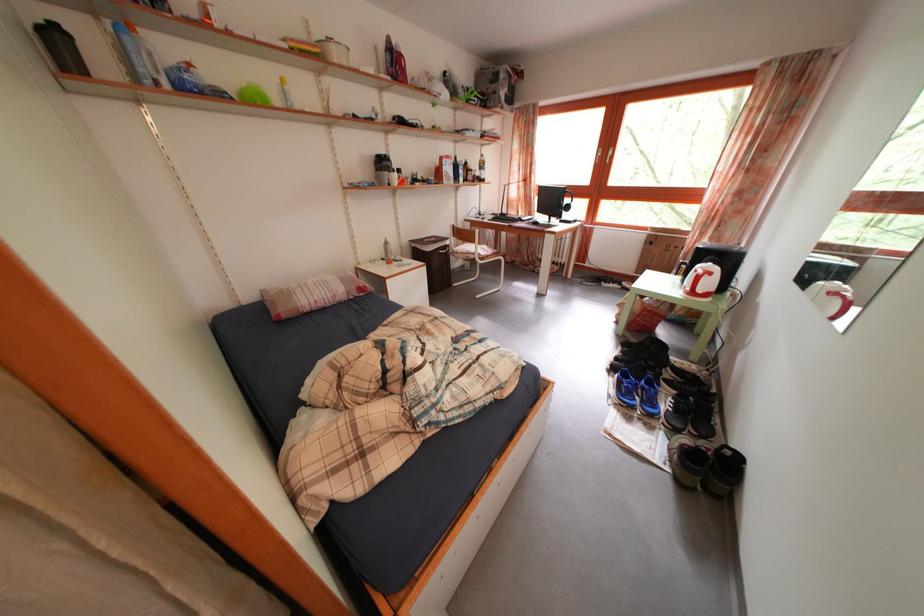
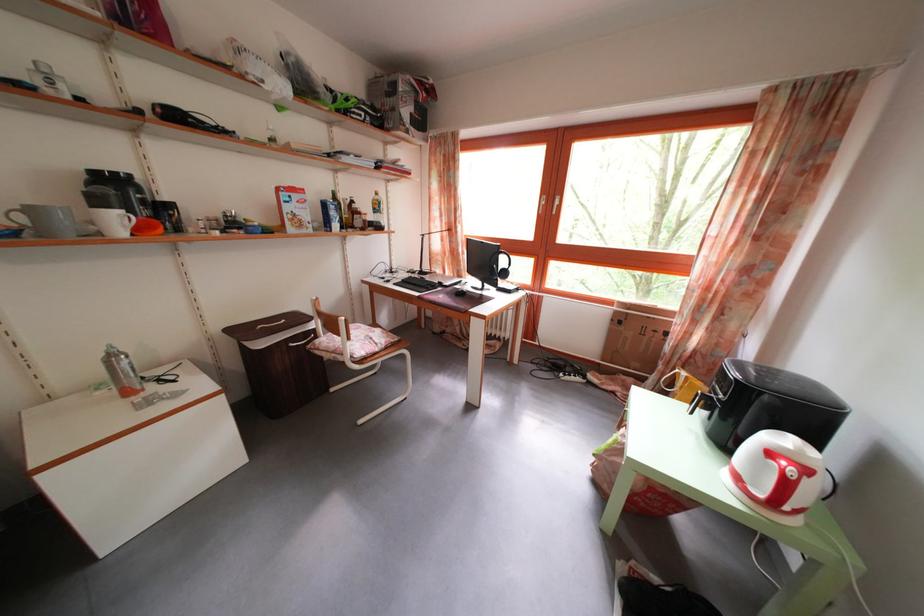
Locate, in the second image, the point that corresponds to point (718, 281) in the first image.

(812, 477)